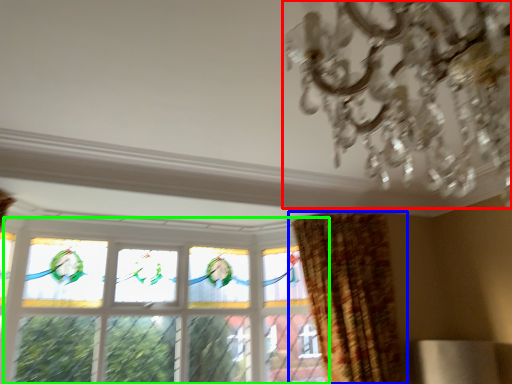
Question: Considering the real-world distances, which object is farthest from chandelier (highlighted by a red box)? curtain (highlighted by a blue box) or window (highlighted by a green box)?

Choices:
 (A) curtain
 (B) window

Answer: (B)